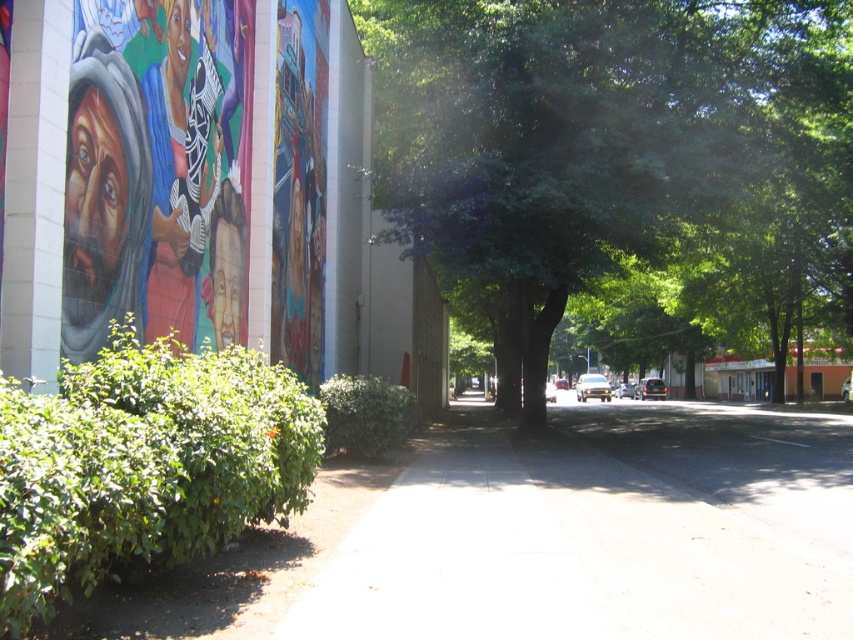
You are a pedestrian standing on the gray concrete sidewalk at center. You want to walk towards the large mural on the left. Which side of the green leafy tree at center should you go around to reach the mural?

Since the green leafy tree at center is to the right of the gray concrete sidewalk at center, you should go around the left side of the green leafy tree at center to reach the mural on the left.

You are a pedestrian standing on the gray concrete sidewalk at center. Looking up, you notice the green leafy tree at center above you. Can you determine if the tree is directly above the sidewalk?

The green leafy tree at center is positioned over gray concrete sidewalk at center, so yes, the tree is directly above the sidewalk.